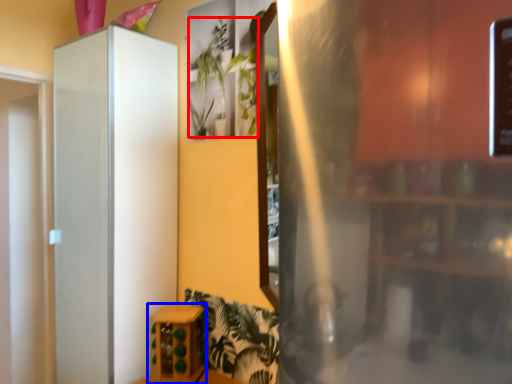
Question: Which of the following is the closest to the observer, plant (highlighted by a red box) or furniture (highlighted by a blue box)?

Choices:
 (A) plant
 (B) furniture

Answer: (A)